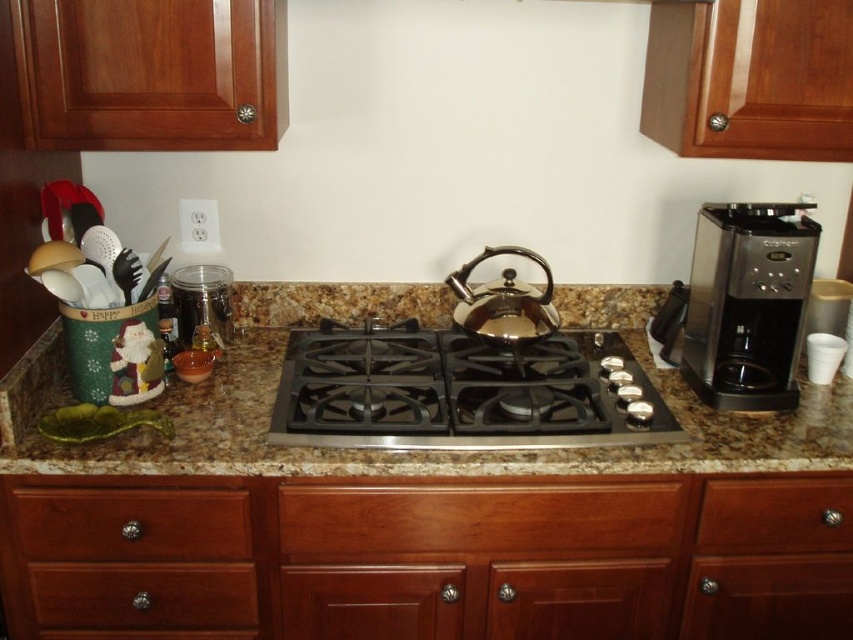
Is black stainless steel gas stove at center smaller than black plastic spoon at left?

No.

Who is more distant from viewer, (401, 385) or (131, 275)?

Positioned behind is point (401, 385).

Does point (386, 348) come behind point (129, 264)?

Yes, it is.

Where is `black stainless steel gas stove at center`? The height and width of the screenshot is (640, 853). black stainless steel gas stove at center is located at coordinates (459, 392).

Is marble granite counter top at center below black plastic spoon at left?

Correct, marble granite counter top at center is located below black plastic spoon at left.

Between point (567, 328) and point (131, 266), which one is positioned behind?

The point (567, 328) is behind.

Find the location of a particular element. marble granite counter top at center is located at coordinates (413, 451).

Which is above, wooden drawer at center or wooden drawer at lower right?

wooden drawer at center

Can you confirm if wooden drawer at center is positioned to the right of wooden drawer at lower right?

Incorrect, wooden drawer at center is not on the right side of wooden drawer at lower right.

Which is in front, point (318, 532) or point (793, 522)?

Positioned in front is point (318, 532).

At what (x,y) coordinates should I click in order to perform the action: click on wooden drawer at center. Please return your answer as a coordinate pair (x, y). This screenshot has height=640, width=853. Looking at the image, I should click on (479, 516).